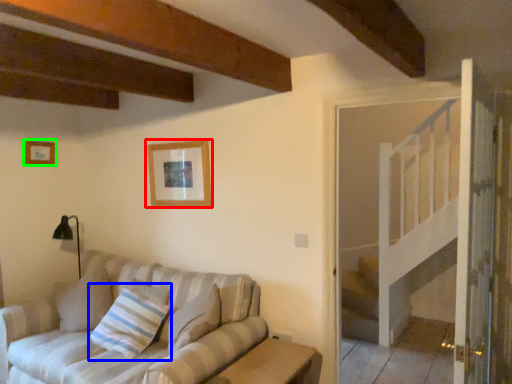
Question: Which object is positioned closest to picture frame (highlighted by a red box)? Select from pillow (highlighted by a blue box) and picture frame (highlighted by a green box).

Choices:
 (A) pillow
 (B) picture frame

Answer: (A)